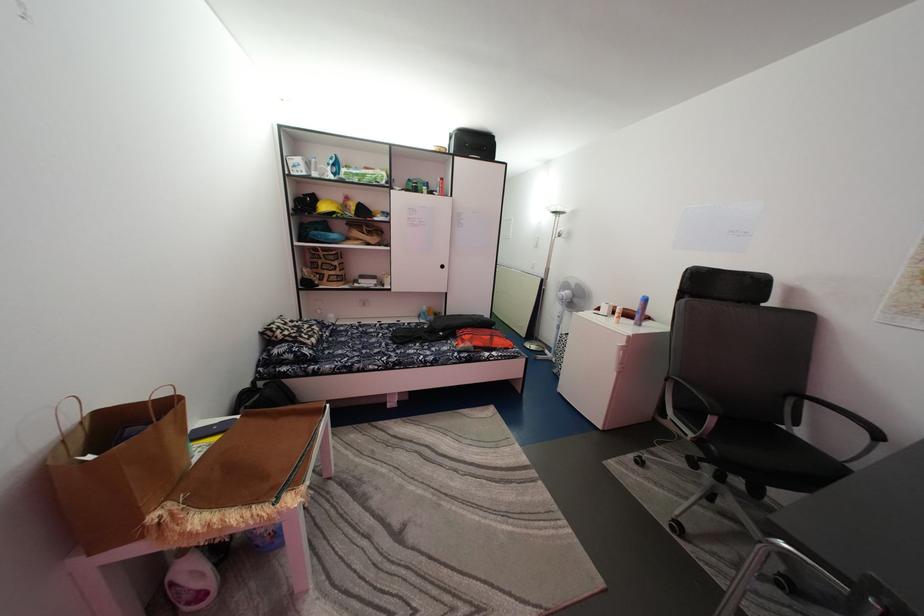
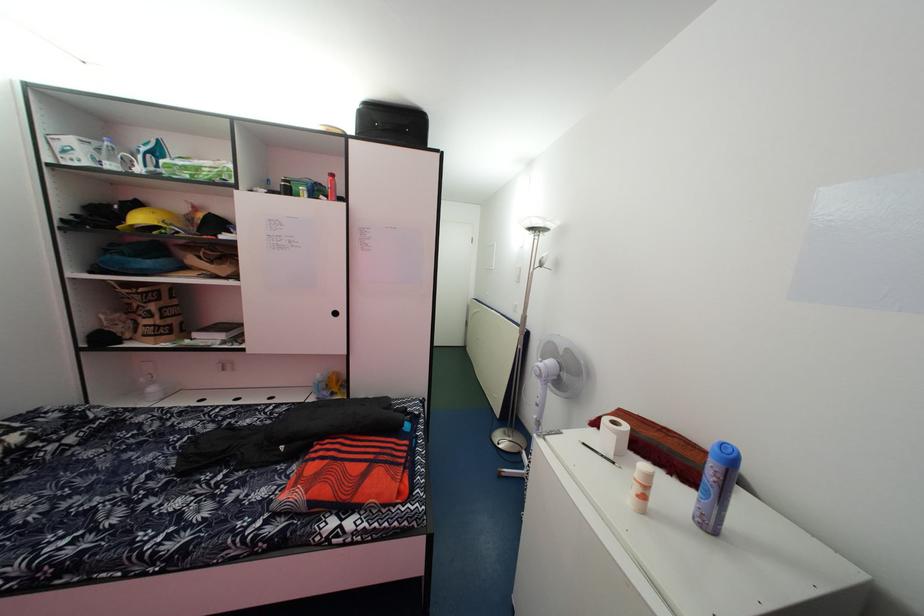
In the second image, find the point that corresponds to [308,167] in the first image.

(79, 148)